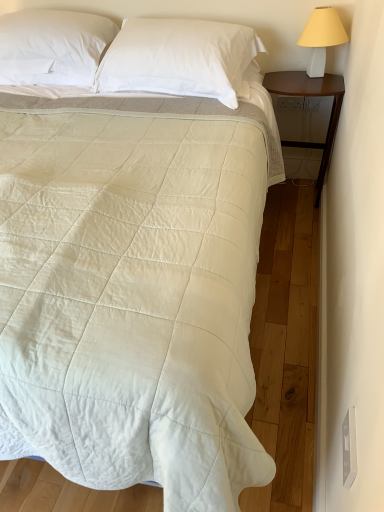
Identify the location of white ceramic lampshade at upper right. The height and width of the screenshot is (512, 384). (321, 37).

Measure the distance between white ceramic lampshade at upper right and camera.

They are 6.28 feet apart.

The height and width of the screenshot is (512, 384). Describe the element at coordinates (138, 270) in the screenshot. I see `white quilted fabric bed at center` at that location.

This screenshot has height=512, width=384. In order to click on dark wood nightstand at right in this screenshot , I will do `click(309, 96)`.

Image resolution: width=384 pixels, height=512 pixels. I want to click on white ceramic lampshade at upper right, so click(321, 37).

Is white quilted fabric bed at center completely or partially outside of white smooth pillow at upper center, marked as the second pillow in a left-to-right arrangement?

Yes.

Which object is thinner, white quilted fabric bed at center or white smooth pillow at upper center, which ranks as the 1th pillow in right-to-left order?

white smooth pillow at upper center, which ranks as the 1th pillow in right-to-left order.

Is white quilted fabric bed at center bigger than white smooth pillow at upper center, marked as the second pillow in a left-to-right arrangement?

Correct, white quilted fabric bed at center is larger in size than white smooth pillow at upper center, marked as the second pillow in a left-to-right arrangement.

Considering their positions, is white quilted fabric bed at center located in front of or behind white smooth pillow at upper center, which ranks as the 1th pillow in right-to-left order?

Clearly, white quilted fabric bed at center is in front of white smooth pillow at upper center, which ranks as the 1th pillow in right-to-left order.

Would you consider white ceramic lampshade at upper right to be distant from white quilted fabric bed at center?

Yes, white ceramic lampshade at upper right and white quilted fabric bed at center are quite far apart.

Is white ceramic lampshade at upper right positioned with its back to white quilted fabric bed at center?

white ceramic lampshade at upper right is not turned away from white quilted fabric bed at center.

Identify the location of bedside lamp located above the white quilted fabric bed at center (from a real-world perspective). (321, 37).

From a real-world perspective, is white smooth pillow at upper center, marked as the second pillow in a left-to-right arrangement, above or below white smooth pillow at upper center, the first pillow in the left-to-right sequence?

white smooth pillow at upper center, marked as the second pillow in a left-to-right arrangement, is situated lower than white smooth pillow at upper center, the first pillow in the left-to-right sequence, in the real world.

Is white smooth pillow at upper center, which ranks as the 1th pillow in right-to-left order, far from white smooth pillow at upper center, acting as the second pillow starting from the right?

No, there isn't a large distance between white smooth pillow at upper center, which ranks as the 1th pillow in right-to-left order, and white smooth pillow at upper center, acting as the second pillow starting from the right.

Do you think white smooth pillow at upper center, which ranks as the 1th pillow in right-to-left order, is within white smooth pillow at upper center, acting as the second pillow starting from the right, or outside of it?

white smooth pillow at upper center, which ranks as the 1th pillow in right-to-left order, exists outside the volume of white smooth pillow at upper center, acting as the second pillow starting from the right.

Consider the image. Is white smooth pillow at upper center, which ranks as the 1th pillow in right-to-left order, to the left or to the right of white smooth pillow at upper center, acting as the second pillow starting from the right, in the image?

In the image, white smooth pillow at upper center, which ranks as the 1th pillow in right-to-left order, appears on the right side of white smooth pillow at upper center, acting as the second pillow starting from the right.

In the scene shown: From a real-world perspective, who is located lower, dark wood nightstand at right or white ceramic lampshade at upper right?

From a 3D spatial view, dark wood nightstand at right is below.

Would you say dark wood nightstand at right is outside white ceramic lampshade at upper right?

Yes, dark wood nightstand at right is located beyond the bounds of white ceramic lampshade at upper right.

What's the angular difference between dark wood nightstand at right and white ceramic lampshade at upper right's facing directions?

They differ by 0.000165 degrees in their facing directions.

Does white smooth pillow at upper center, marked as the second pillow in a left-to-right arrangement, turn towards dark wood nightstand at right?

No, white smooth pillow at upper center, marked as the second pillow in a left-to-right arrangement, is not oriented towards dark wood nightstand at right.

Is white smooth pillow at upper center, marked as the second pillow in a left-to-right arrangement, not inside dark wood nightstand at right?

Yes, white smooth pillow at upper center, marked as the second pillow in a left-to-right arrangement, is outside of dark wood nightstand at right.

In the scene shown: Which object is thinner, white smooth pillow at upper center, which ranks as the 1th pillow in right-to-left order, or dark wood nightstand at right?

With smaller width is dark wood nightstand at right.

Considering the sizes of objects white smooth pillow at upper center, which ranks as the 1th pillow in right-to-left order, and dark wood nightstand at right in the image provided, who is smaller, white smooth pillow at upper center, which ranks as the 1th pillow in right-to-left order, or dark wood nightstand at right?

With smaller size is white smooth pillow at upper center, which ranks as the 1th pillow in right-to-left order.

Which object is closer to the camera, dark wood nightstand at right or white quilted fabric bed at center?

Positioned in front is white quilted fabric bed at center.

Can you confirm if dark wood nightstand at right is wider than white quilted fabric bed at center?

In fact, dark wood nightstand at right might be narrower than white quilted fabric bed at center.

Find the location of a particular element. The width and height of the screenshot is (384, 512). nightstand on the right side of white quilted fabric bed at center is located at coordinates (309, 96).

From the image's perspective, would you say dark wood nightstand at right is shown under white quilted fabric bed at center?

No.

The width and height of the screenshot is (384, 512). Find the location of `nightstand behind the white smooth pillow at upper center, the first pillow in the left-to-right sequence`. nightstand behind the white smooth pillow at upper center, the first pillow in the left-to-right sequence is located at coordinates (309, 96).

Who is taller, dark wood nightstand at right or white smooth pillow at upper center, acting as the second pillow starting from the right?

dark wood nightstand at right.

Consider the image. Can you tell me how much dark wood nightstand at right and white smooth pillow at upper center, acting as the second pillow starting from the right, differ in facing direction?

There is a 4.4-degree angle between the facing directions of dark wood nightstand at right and white smooth pillow at upper center, acting as the second pillow starting from the right.

From the image's perspective, does dark wood nightstand at right appear lower than white smooth pillow at upper center, the first pillow in the left-to-right sequence?

Yes, from the image's perspective, dark wood nightstand at right is beneath white smooth pillow at upper center, the first pillow in the left-to-right sequence.

From the image's perspective, count 1st pillows upward from the white quilted fabric bed at center and point to it. Please provide its 2D coordinates.

[(180, 58)]

Where is `bed that is on the left side of white ceramic lampshade at upper right`? Image resolution: width=384 pixels, height=512 pixels. bed that is on the left side of white ceramic lampshade at upper right is located at coordinates (138, 270).

Considering their positions, is white ceramic lampshade at upper right positioned further to white smooth pillow at upper center, which ranks as the 1th pillow in right-to-left order, than white quilted fabric bed at center?

white ceramic lampshade at upper right is further to white smooth pillow at upper center, which ranks as the 1th pillow in right-to-left order.

From the image, which object appears to be farther from white quilted fabric bed at center, dark wood nightstand at right or white ceramic lampshade at upper right?

white ceramic lampshade at upper right is positioned further to the anchor white quilted fabric bed at center.

Which object lies nearer to the anchor point white smooth pillow at upper center, the first pillow in the left-to-right sequence, white quilted fabric bed at center or white ceramic lampshade at upper right?

Among the two, white quilted fabric bed at center is located nearer to white smooth pillow at upper center, the first pillow in the left-to-right sequence.

When comparing their distances from white quilted fabric bed at center, does white smooth pillow at upper center, which ranks as the 1th pillow in right-to-left order, or white smooth pillow at upper center, acting as the second pillow starting from the right, seem further?

Among the two, white smooth pillow at upper center, acting as the second pillow starting from the right, is located further to white quilted fabric bed at center.

Considering their positions, is dark wood nightstand at right positioned closer to white smooth pillow at upper center, marked as the second pillow in a left-to-right arrangement, than white ceramic lampshade at upper right?

The object closer to white smooth pillow at upper center, marked as the second pillow in a left-to-right arrangement, is dark wood nightstand at right.

Estimate the real-world distances between objects in this image. Which object is further from white ceramic lampshade at upper right, white quilted fabric bed at center or dark wood nightstand at right?

Based on the image, white quilted fabric bed at center appears to be further to white ceramic lampshade at upper right.

From the image, which object appears to be nearer to white smooth pillow at upper center, which ranks as the 1th pillow in right-to-left order, white ceramic lampshade at upper right or dark wood nightstand at right?

dark wood nightstand at right lies closer to white smooth pillow at upper center, which ranks as the 1th pillow in right-to-left order, than the other object.

From the image, which object appears to be farther from white smooth pillow at upper center, acting as the second pillow starting from the right, dark wood nightstand at right or white ceramic lampshade at upper right?

The object further to white smooth pillow at upper center, acting as the second pillow starting from the right, is white ceramic lampshade at upper right.

This screenshot has height=512, width=384. I want to click on pillow between white smooth pillow at upper center, acting as the second pillow starting from the right, and dark wood nightstand at right, in the horizontal direction, so click(180, 58).

Locate an element on the screen. The image size is (384, 512). pillow between white smooth pillow at upper center, acting as the second pillow starting from the right, and white ceramic lampshade at upper right, in the horizontal direction is located at coordinates (180, 58).

The image size is (384, 512). I want to click on nightstand between white smooth pillow at upper center, which ranks as the 1th pillow in right-to-left order, and white ceramic lampshade at upper right, so click(309, 96).

Locate an element on the screen. The height and width of the screenshot is (512, 384). bed between white smooth pillow at upper center, acting as the second pillow starting from the right, and white ceramic lampshade at upper right from left to right is located at coordinates (138, 270).